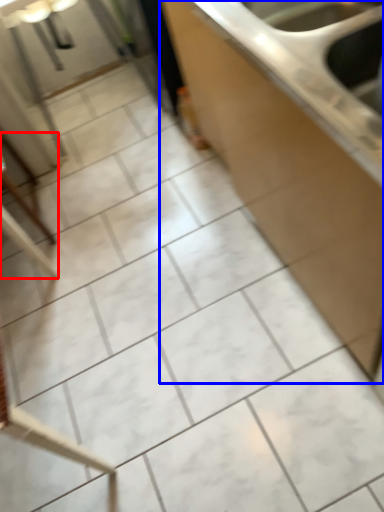
Question: Which point is further to the camera, furniture (highlighted by a red box) or countertop (highlighted by a blue box)?

Choices:
 (A) furniture
 (B) countertop

Answer: (A)